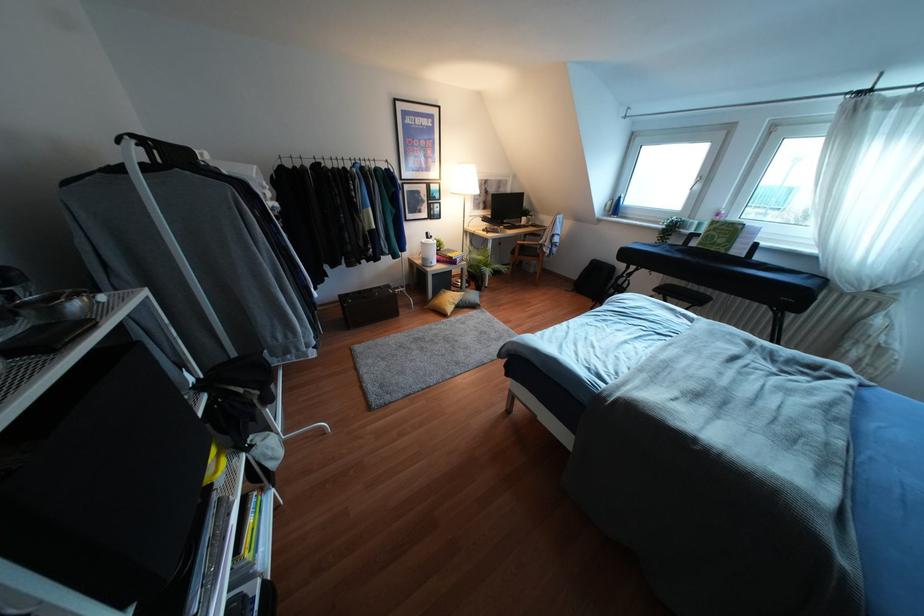
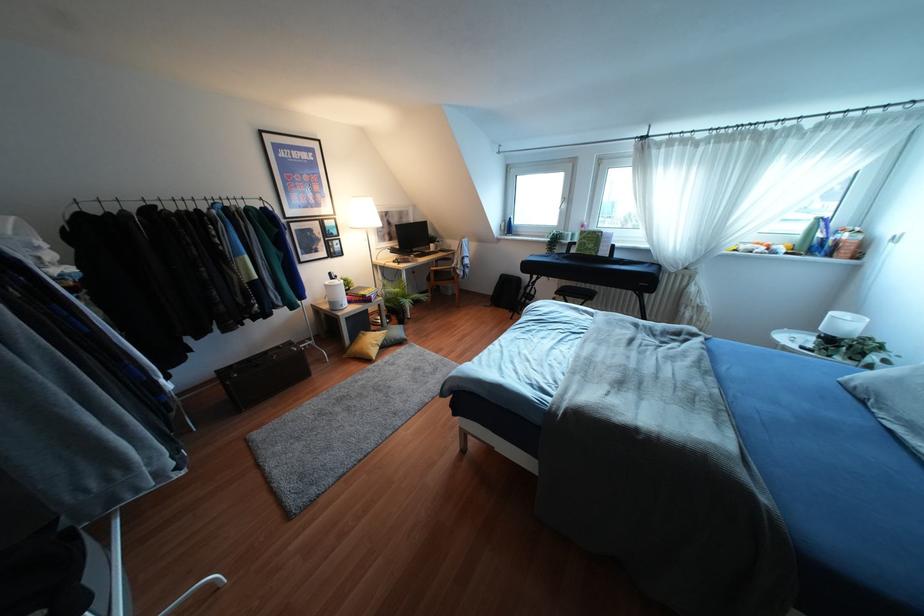
Question: The images are taken continuously from a first-person perspective. In which direction are you moving?

Choices:
 (A) Left
 (B) Right
 (C) Forward
 (D) Backward

Answer: (C)